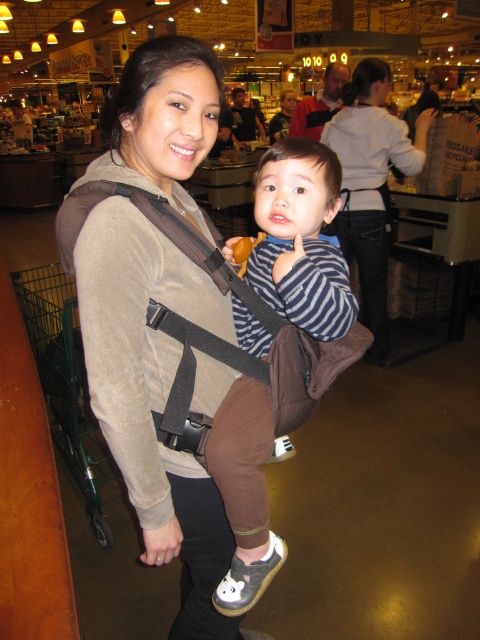
You are a customer trying to decide which item to buy between the striped fabric shirt at center and the white hoodie at center. Based on their sizes, which one do you think is shorter?

The striped fabric shirt at center is not as tall as the white hoodie at center, so the striped fabric shirt at center is shorter.

You are a delivery person who needs to locate the brown fabric baby carrier at center in the grocery store. According to the coordinates provided, where exactly is it located?

Result: The brown fabric baby carrier at center is located at point [158,321].